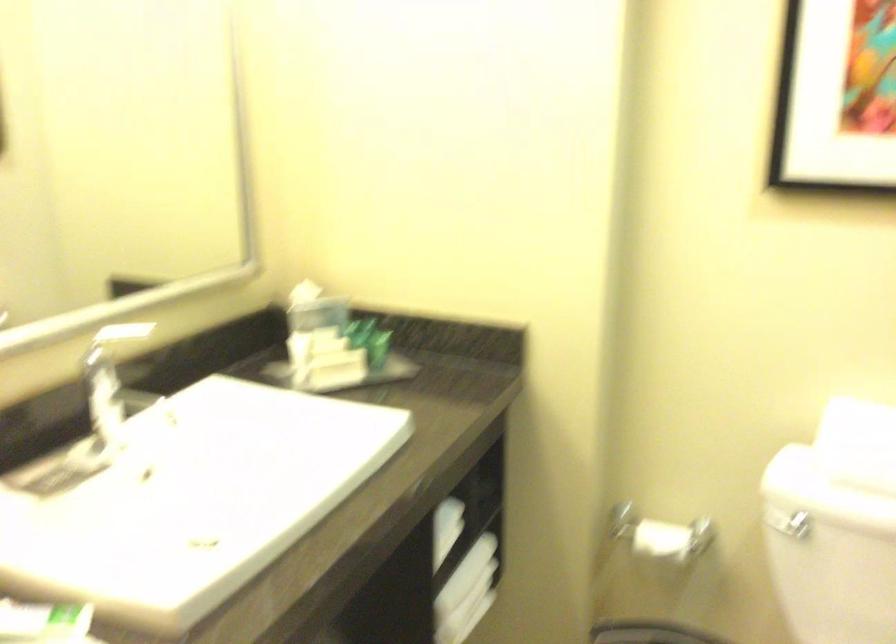
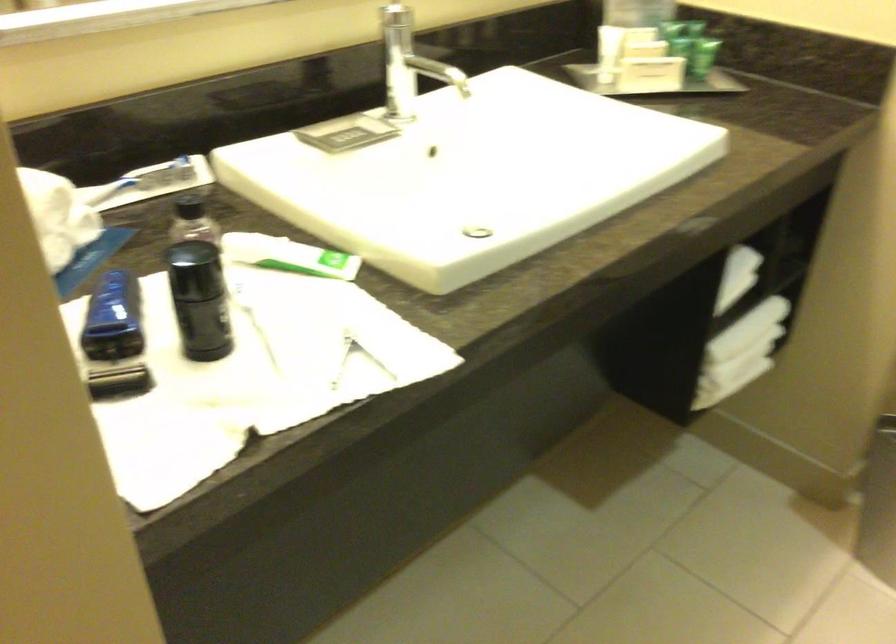
Question: The images are taken continuously from a first-person perspective. In which direction are you moving?

Choices:
 (A) Left
 (B) Right
 (C) Forward
 (D) Backward

Answer: (C)